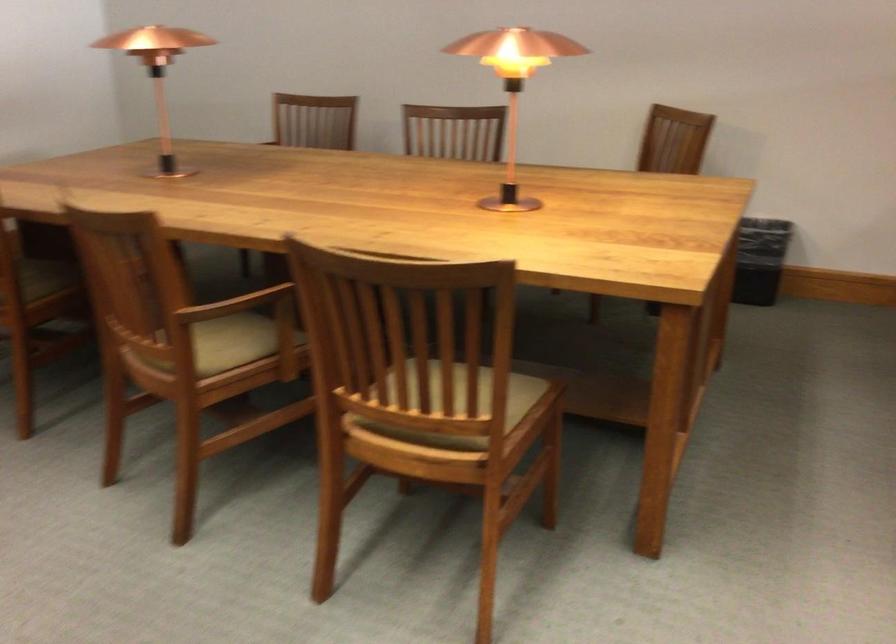
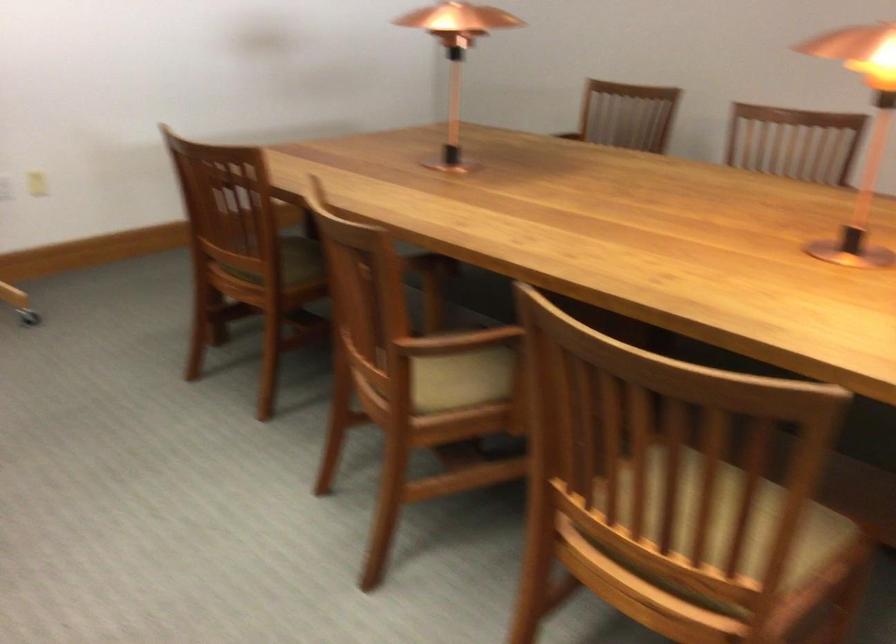
Find the pixel in the second image that matches point 468,379 in the first image.

(728, 526)